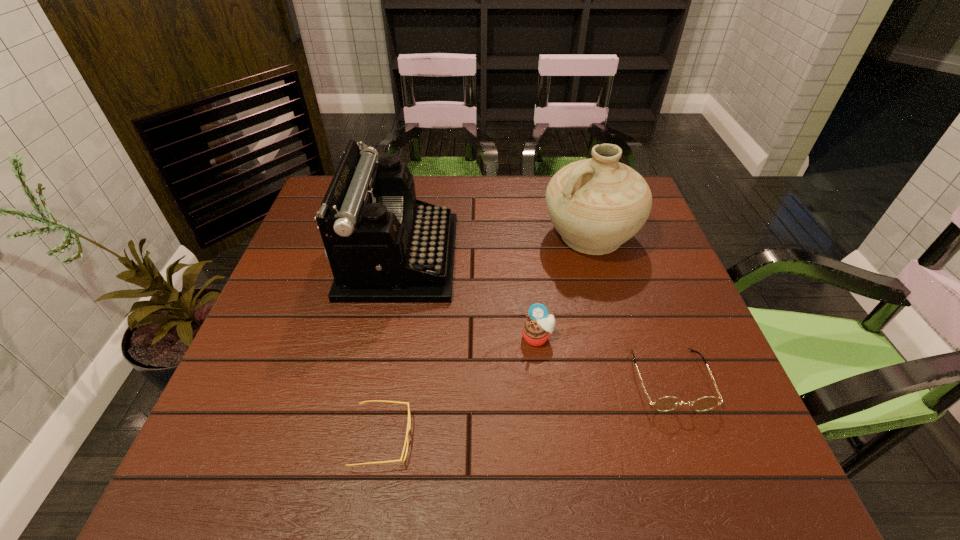
Where is `vacant region between the shorter spectacles and the second shortest object`? The width and height of the screenshot is (960, 540). vacant region between the shorter spectacles and the second shortest object is located at coordinates (526, 409).

Where is `unoccupied area between the pottery and the muffin`? The width and height of the screenshot is (960, 540). unoccupied area between the pottery and the muffin is located at coordinates (564, 287).

Locate an element on the screen. The height and width of the screenshot is (540, 960). free spot between the typewriter and the third tallest object is located at coordinates (468, 297).

Find the location of `object that stands as the third closest to the taller spectacles`. object that stands as the third closest to the taller spectacles is located at coordinates (384, 246).

Where is `object that stands as the closest to the shortest object`? This screenshot has width=960, height=540. object that stands as the closest to the shortest object is located at coordinates pos(536,329).

Identify the location of vacant point that satisfies the following two spatial constraints: 1. on the lenses of the second shortest object; 2. in front of the lenses of the left spectacles. Image resolution: width=960 pixels, height=540 pixels. (692, 438).

Identify the location of vacant space that satisfies the following two spatial constraints: 1. on the front side of the pottery; 2. in front of the lenses of the shorter spectacles. The width and height of the screenshot is (960, 540). (647, 438).

Locate an element on the screen. The image size is (960, 540). vacant region that satisfies the following two spatial constraints: 1. on the front-facing side of the third object from left to right; 2. in front of the lenses of the left spectacles is located at coordinates (549, 438).